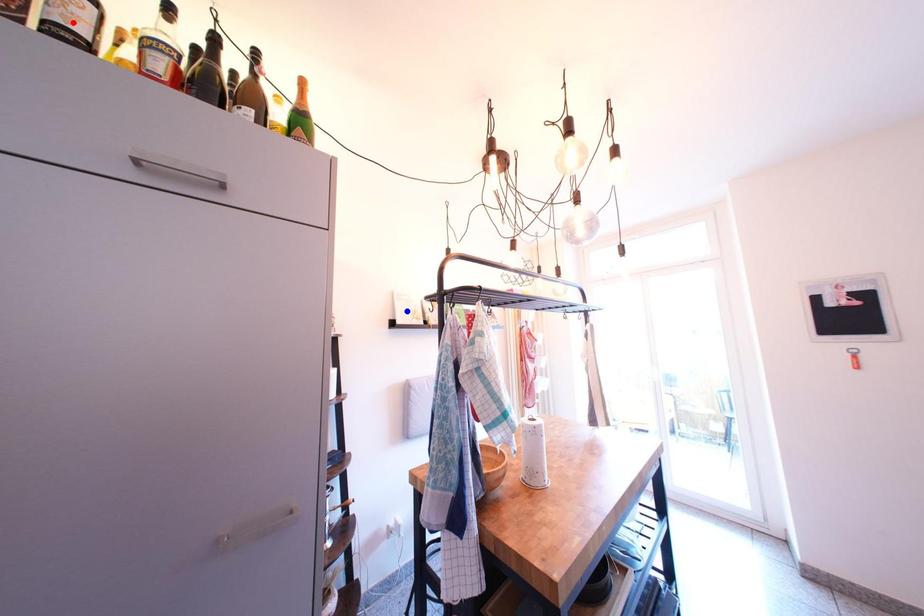
Question: Which of the two points in the image is closer to the camera?

Choices:
 (A) Blue point is closer.
 (B) Red point is closer.

Answer: (B)